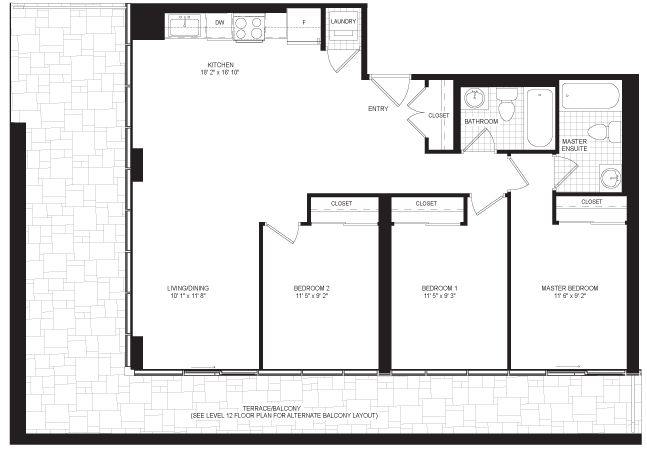
Locate an element on the screen. Image resolution: width=647 pixels, height=458 pixels. inside house is located at coordinates (239, 121), (558, 266), (355, 268), (464, 268), (510, 127), (587, 153).